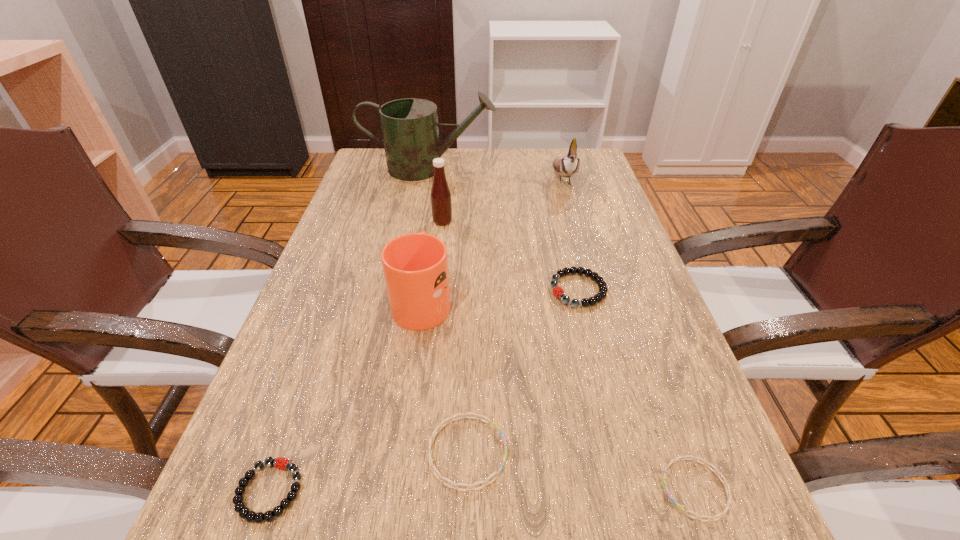
You are a GUI agent. You are given a task and a screenshot of the screen. Output one action in this format:
    pyautogui.click(x=<x>, y=<y>)
    Task: Click on the empty space between the mug and the bird
    
    Given the screenshot: What is the action you would take?
    coord(492,240)

Locate an element on the screen. vacant area that lies between the shortest bracelet and the left blue bracelet is located at coordinates pyautogui.click(x=581, y=470).

You are a GUI agent. You are given a task and a screenshot of the screen. Output one action in this format:
    pyautogui.click(x=<x>, y=<y>)
    Task: Click on the vacant point located between the leftmost bracelet and the sixth nearest object
    This screenshot has height=540, width=960.
    Given the screenshot: What is the action you would take?
    pyautogui.click(x=356, y=356)

You are a GUI agent. You are given a task and a screenshot of the screen. Output one action in this format:
    pyautogui.click(x=<x>, y=<y>)
    Task: Click on the vacant area that lies between the nearer black bracelet and the tallest bracelet
    The width and height of the screenshot is (960, 540).
    Given the screenshot: What is the action you would take?
    [424, 390]

Where is `vacant area that lies between the third farthest object and the right blue bracelet`? This screenshot has width=960, height=540. vacant area that lies between the third farthest object and the right blue bracelet is located at coordinates (569, 355).

The image size is (960, 540). I want to click on vacant region between the shortest bracelet and the orange mug, so click(559, 394).

In order to click on free space between the nearer black bracelet and the bird in this screenshot , I will do `click(417, 335)`.

I want to click on the fifth closest object to the orange mug, so click(722, 514).

Identify the location of object that stands as the closest to the bigger blue bracelet. This screenshot has height=540, width=960. (244, 512).

Where is `bracelet that can be found as the second closest to the third bracelet from right to left`? The height and width of the screenshot is (540, 960). bracelet that can be found as the second closest to the third bracelet from right to left is located at coordinates (722, 514).